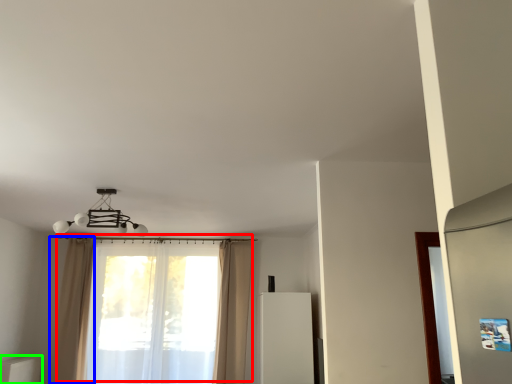
Question: Which object is the closest to the curtain (highlighted by a red box)? Choose among these: curtain (highlighted by a blue box) or furniture (highlighted by a green box).

Choices:
 (A) curtain
 (B) furniture

Answer: (A)